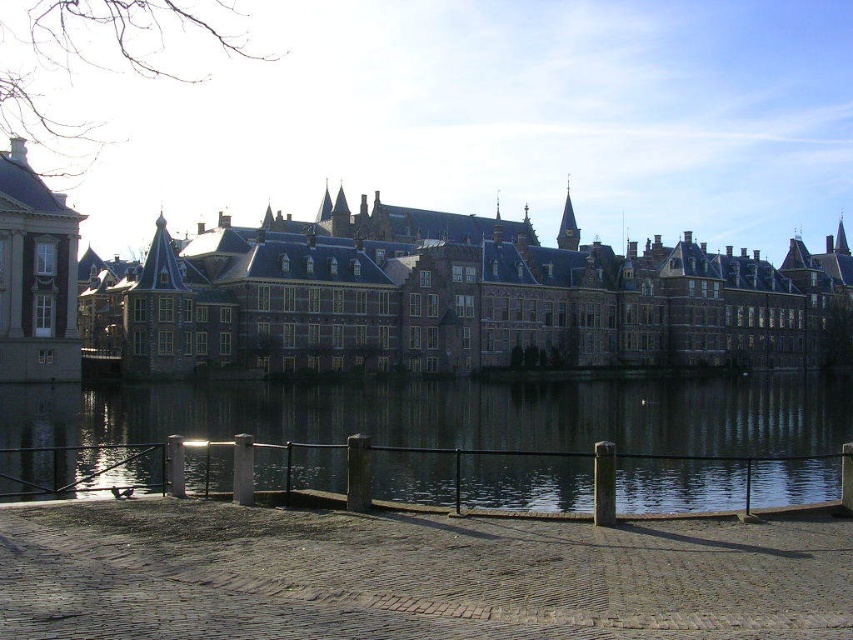
Can you confirm if brown brick castle at center is positioned above dark reflective water at center?

Yes.

Does brown brick castle at center have a lesser width compared to dark reflective water at center?

Incorrect, brown brick castle at center's width is not less than dark reflective water at center's.

Between point (697, 364) and point (781, 404), which one is positioned behind?

Point (697, 364)

The height and width of the screenshot is (640, 853). Find the location of `brown brick castle at center`. brown brick castle at center is located at coordinates (457, 298).